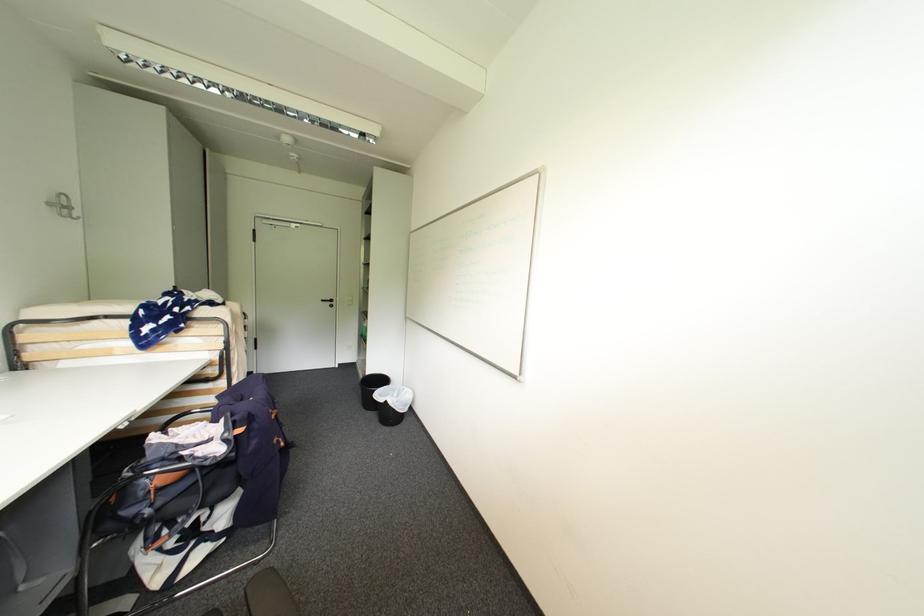
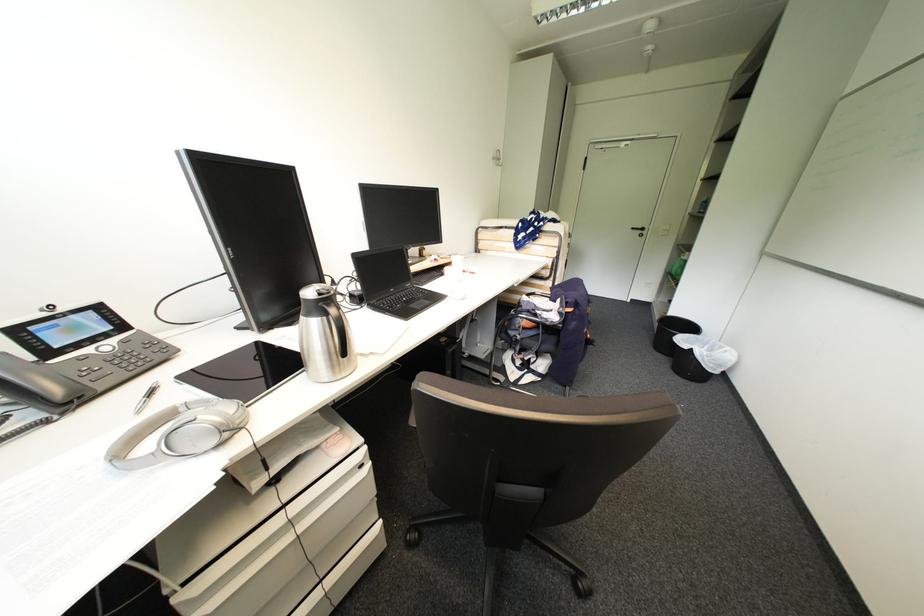
The point at [336,304] is marked in the first image. Where is the corresponding point in the second image?

(648, 233)